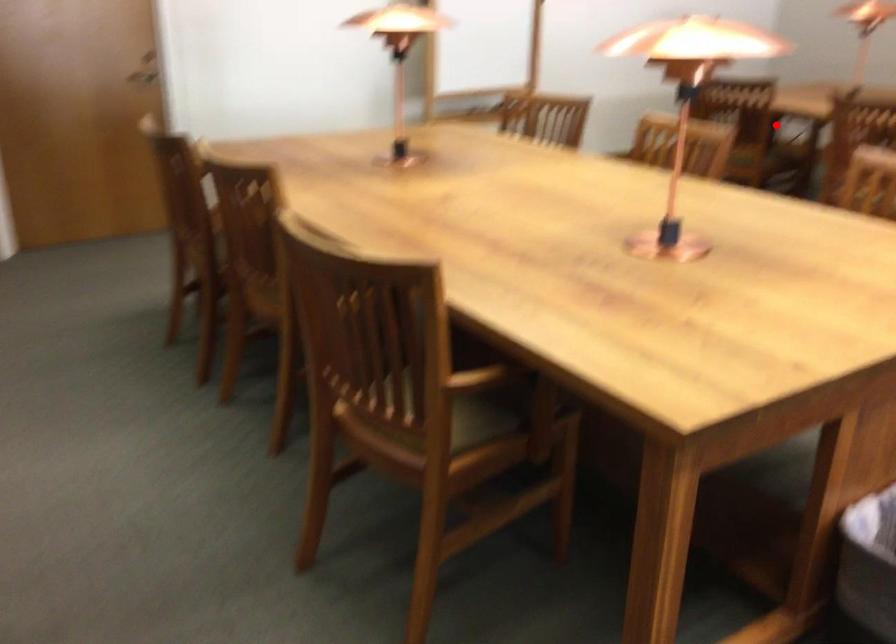
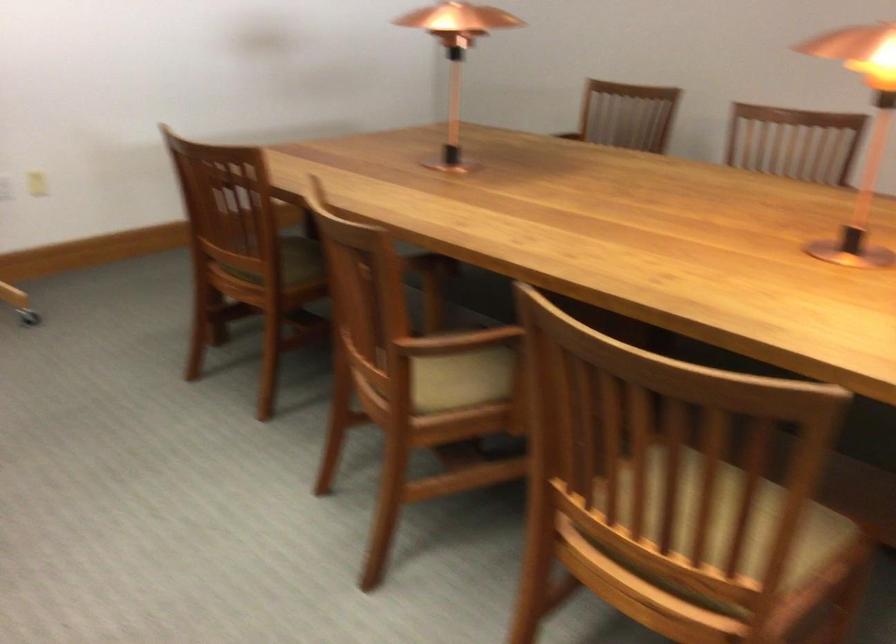
Question: I am providing you with two images of the same scene from different viewpoints. Image1 has a red point marked. In image2, the corresponding 3D location appears at what relative position? Reply with the corresponding letter.

Choices:
 (A) Closer
 (B) Farther

Answer: (A)